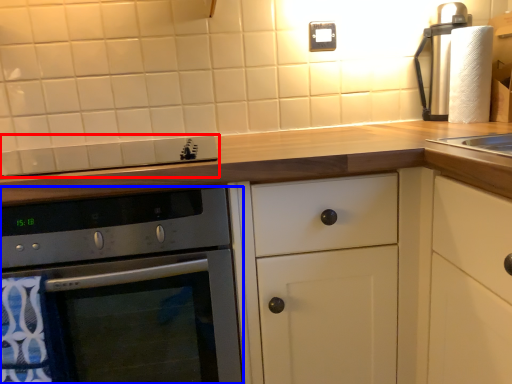
Question: Which point is closer to the camera, gas stove (highlighted by a red box) or oven (highlighted by a blue box)?

Choices:
 (A) gas stove
 (B) oven

Answer: (B)